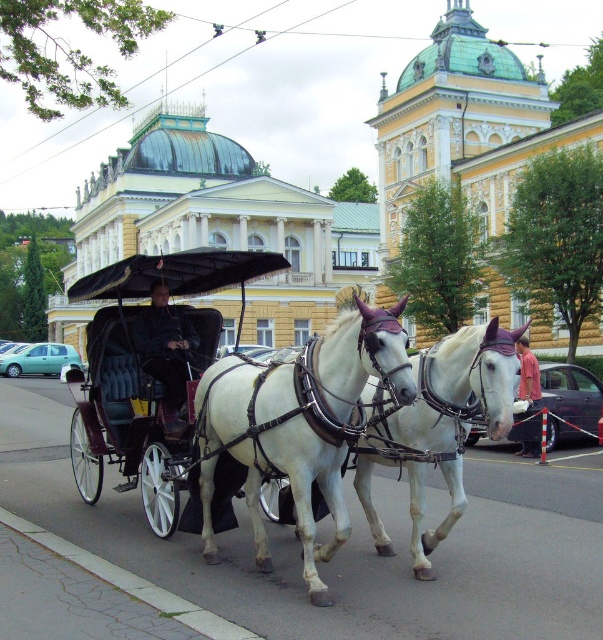
Question: Which object is closer to the camera taking this photo?

Choices:
 (A) white glossy horse cart at center
 (B) black leather coach at center

Answer: (A)

Question: Does black leather carriage at center have a lesser width compared to black leather coach at center?

Choices:
 (A) yes
 (B) no

Answer: (B)

Question: Among these points, which one is farthest from the camera?

Choices:
 (A) (171, 385)
 (B) (169, 413)
 (C) (300, 445)
 (D) (531, 364)

Answer: (D)

Question: Which object appears farthest from the camera in this image?

Choices:
 (A) white leather horse at center
 (B) white glossy horse at center

Answer: (B)

Question: Does white glossy horse cart at center lie behind red cotton shirt at lower right?

Choices:
 (A) yes
 (B) no

Answer: (B)

Question: Is black leather carriage at center above red cotton shirt at lower right?

Choices:
 (A) yes
 (B) no

Answer: (A)